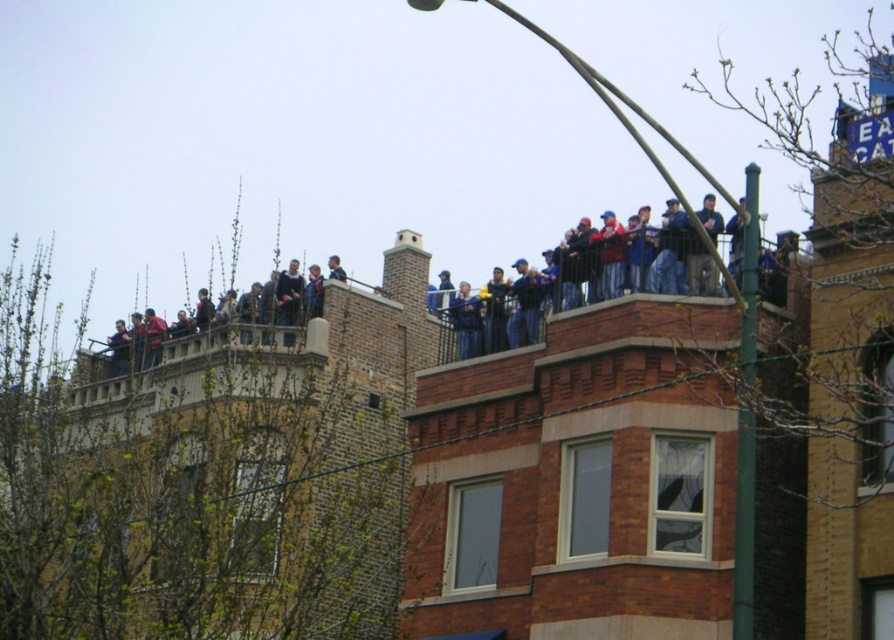
You are a painter who needs to place a 1.5 meter wide canvas between the green painted metal pole at upper right and the blue denim jeans at upper center. Based on their widths, will the canvas fit between them?

The green painted metal pole at upper right might be wider than blue denim jeans at upper center, so the total space between them is uncertain. The painter cannot be sure if the 1.5 meter wide canvas will fit without knowing the exact widths of both objects.